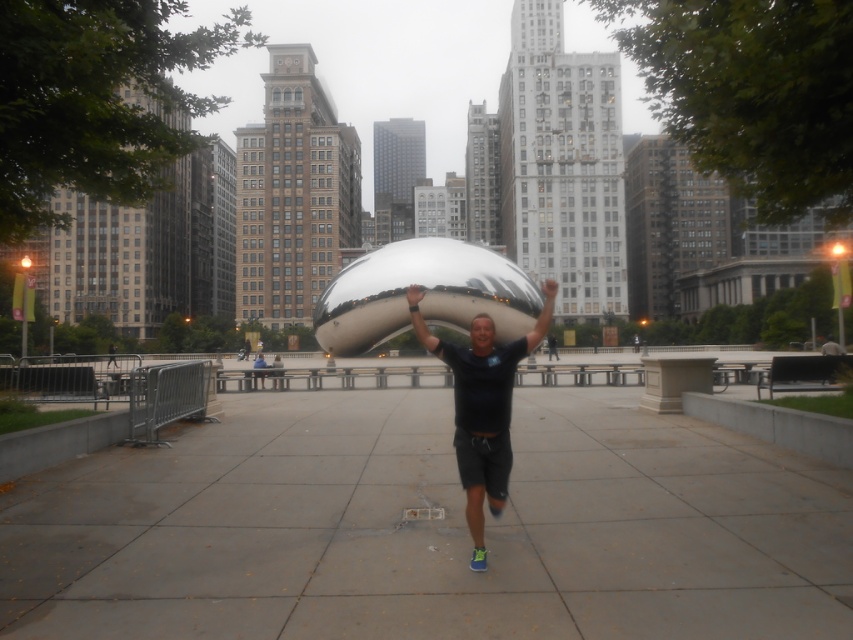
Consider the image. Between gray concrete pavement at center and smooth skin head at center, which one appears on the right side from the viewer's perspective?

smooth skin head at center is more to the right.

Identify the location of gray concrete pavement at center. This screenshot has height=640, width=853. (430, 529).

Can you confirm if gray concrete pavement at center is thinner than black matte shirt at center?

Indeed, gray concrete pavement at center has a lesser width compared to black matte shirt at center.

The width and height of the screenshot is (853, 640). What do you see at coordinates (430, 529) in the screenshot?
I see `gray concrete pavement at center` at bounding box center [430, 529].

Which is behind, point (402, 442) or point (459, 413)?

Point (402, 442)

The image size is (853, 640). Find the location of `gray concrete pavement at center`. gray concrete pavement at center is located at coordinates (430, 529).

From the picture: Is black matte shirt at center positioned before smooth skin head at center?

No, black matte shirt at center is further to the viewer.

Does point (503, 433) come behind point (479, 314)?

No.

The height and width of the screenshot is (640, 853). Find the location of `black matte shirt at center`. black matte shirt at center is located at coordinates (482, 412).